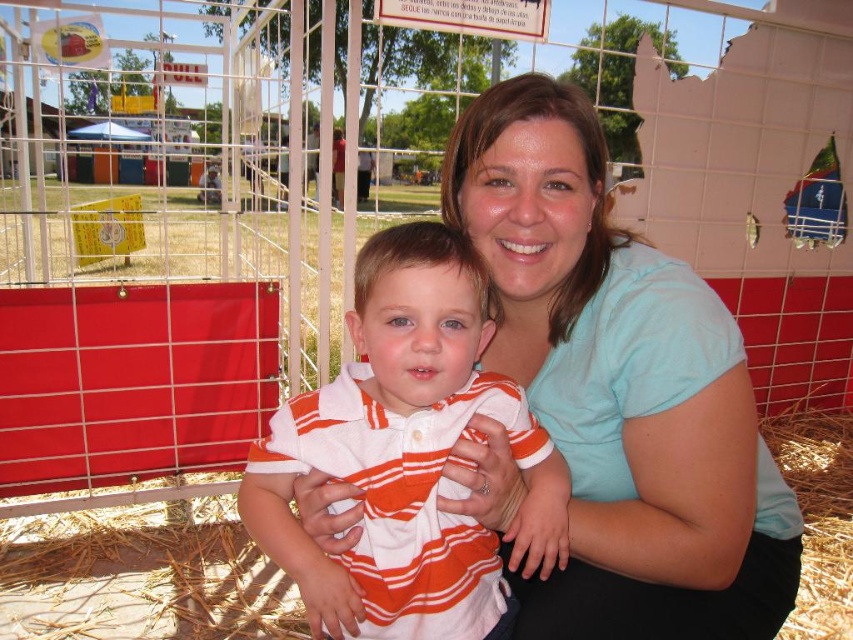
Question: Which point is farther to the camera?

Choices:
 (A) [x=490, y=125]
 (B) [x=320, y=563]

Answer: (A)

Question: Which point is closer to the camera?

Choices:
 (A) orange striped polo shirt at center
 (B) light blue shirt at center

Answer: (A)

Question: Which point is closer to the camera?

Choices:
 (A) (648, 419)
 (B) (390, 346)

Answer: (B)

Question: Is light blue shirt at center smaller than orange striped polo shirt at center?

Choices:
 (A) yes
 (B) no

Answer: (B)

Question: Can you confirm if light blue shirt at center is thinner than orange striped polo shirt at center?

Choices:
 (A) no
 (B) yes

Answer: (A)

Question: Is light blue shirt at center to the left of orange striped polo shirt at center from the viewer's perspective?

Choices:
 (A) yes
 (B) no

Answer: (B)